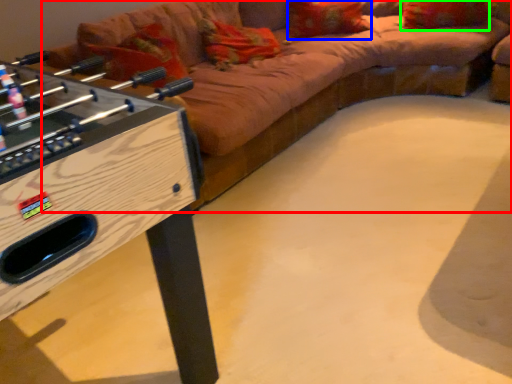
Question: Which object is the farthest from studio couch (highlighted by a red box)? Choose among these: pillow (highlighted by a blue box) or pillow (highlighted by a green box).

Choices:
 (A) pillow
 (B) pillow

Answer: (B)